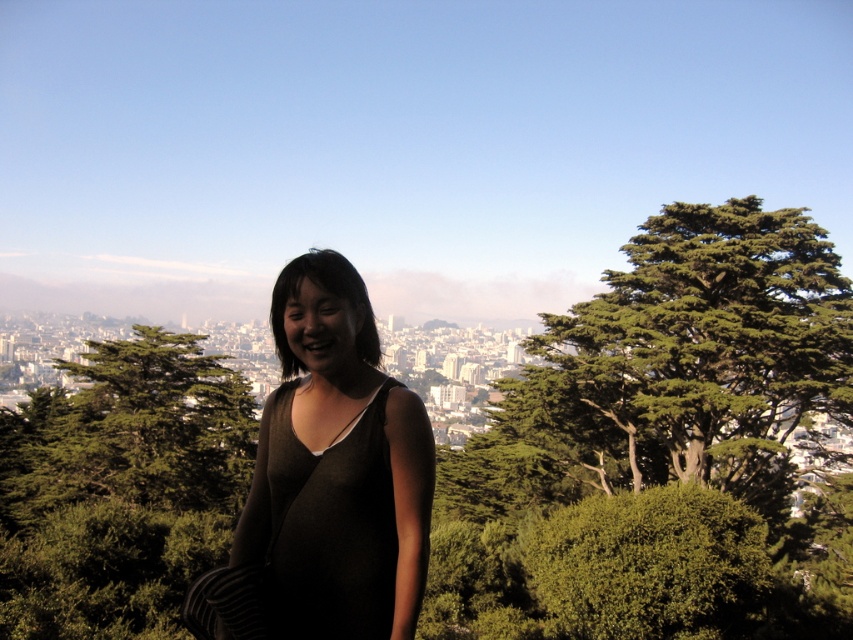
Who is shorter, green leafy tree at center or matte black dress at center?

Standing shorter between the two is green leafy tree at center.

Is green leafy tree at center positioned behind matte black dress at center?

No.

Does point (132, 554) lie behind point (258, 540)?

No, it is not.

I want to click on green leafy tree at center, so click(120, 490).